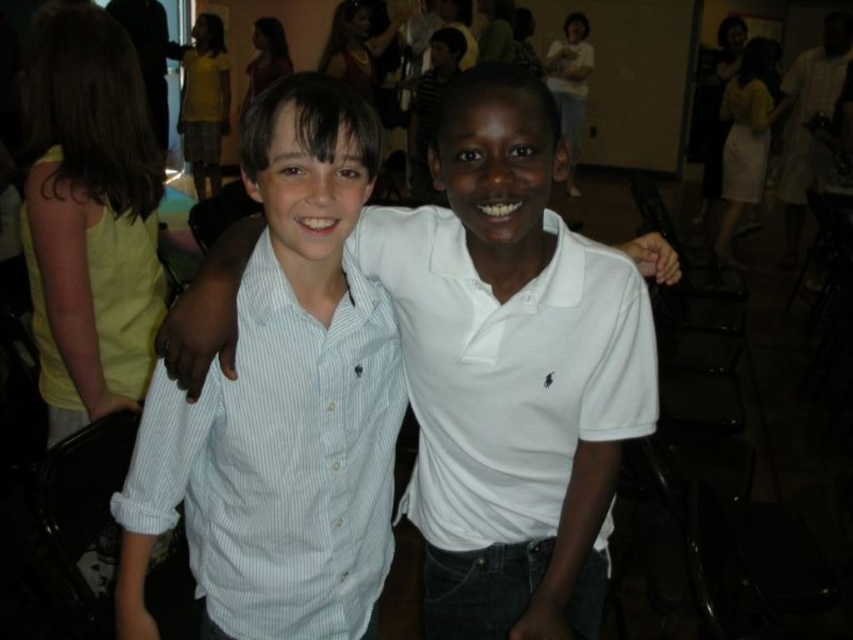
You are organizing a clothing donation drive and need to categorize shirts by size. You have two shirts in front of you labeled as white striped shirt at center and white cotton shirt at center. Based on their sizes, which one should you place in the small section?

The white striped shirt at center has a smaller size compared to the white cotton shirt at center, so it should be placed in the small section.

You are at a community event and need to identify two boys wearing white shirts. The first boy is wearing a white cotton shirt at center, and the second is wearing a white cotton polo shirt at center. Which boy is positioned to the right of the other?

The white cotton polo shirt at center is to the right of the white cotton shirt at center.